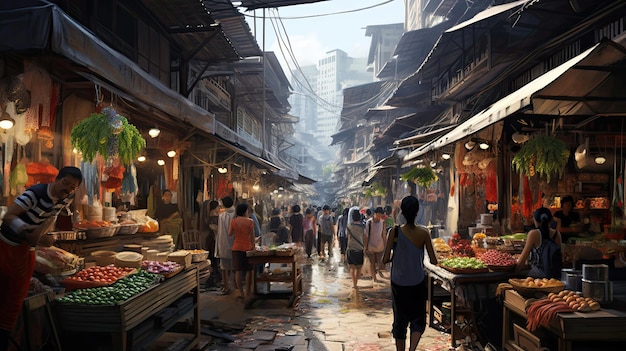
Locate an element on the screen. The image size is (626, 351). hanging green plants is located at coordinates click(96, 131), click(540, 149), click(424, 176).